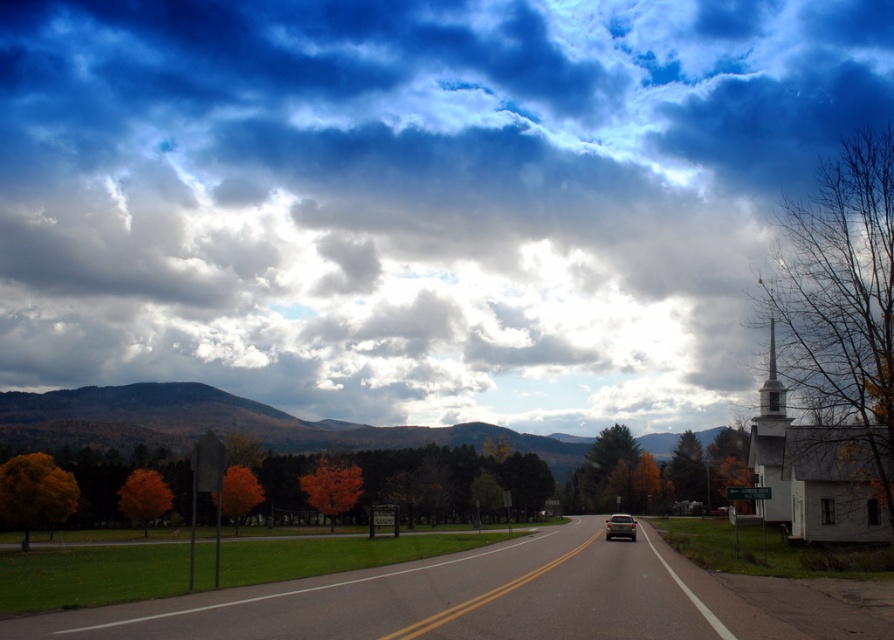
You are driving a car and see the green forested mountain at center and the satin silver sedan at center. Which object is higher in the image?

The green forested mountain at center is higher than the satin silver sedan at center in the image.

You are standing at the starting point of the asphalt road at center and want to reach the white wooden spire at upper right. Which direction should you walk to get closer to the spire?

The asphalt road at center is below the white wooden spire at upper right, so you should walk upwards along the asphalt road at center towards the spire to get closer.